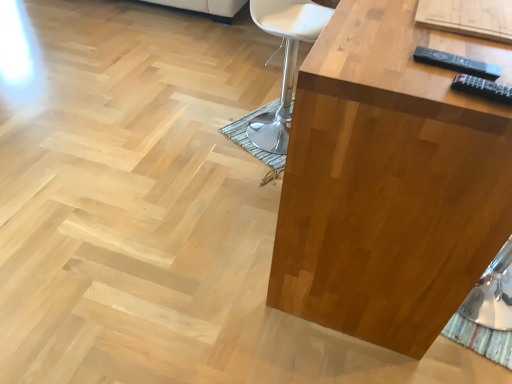
Locate an element on the screen. Image resolution: width=512 pixels, height=384 pixels. vacant space situated on the left part of black plastic remote at upper right, the first remote in the top-to-bottom sequence is located at coordinates pos(374,61).